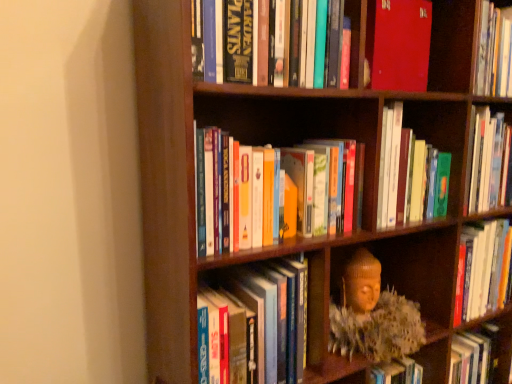
Question: In terms of height, does hardcover books at center, which ranks as the 3th book in bottom-to-top order, look taller or shorter compared to matte red book at upper center, which is counted as the first book, starting from the top?

Choices:
 (A) tall
 (B) short

Answer: (A)

Question: Would you say hardcover books at center, the 3th book in the top-to-bottom sequence, is to the left or to the right of matte red book at upper center, marked as the 5th book in a bottom-to-top arrangement, in the picture?

Choices:
 (A) left
 (B) right

Answer: (B)

Question: Which object is the farthest from the matte red book at upper center, which is counted as the first book, starting from the top?

Choices:
 (A) hardcover books at upper center, placed as the fourth book when sorted from bottom to top
 (B) hardcover books at center, the second book when ordered from bottom to top
 (C) hardcover books at center, which ranks as the 3th book in bottom-to-top order
 (D) hardcover book at center, the fifth book in the top-to-bottom sequence
 (E) wooden bookcase at center

Answer: (D)

Question: Estimate the real-world distances between objects in this image. Which object is farther from the matte red book at upper center, which is counted as the first book, starting from the top?

Choices:
 (A) hardcover books at upper center, the 2th book viewed from the top
 (B) hardcover book at center, the fifth book in the top-to-bottom sequence
 (C) hardcover books at center, the second book when ordered from bottom to top
 (D) hardcover books at center, the 3th book in the top-to-bottom sequence
 (E) wooden bookcase at center

Answer: (B)